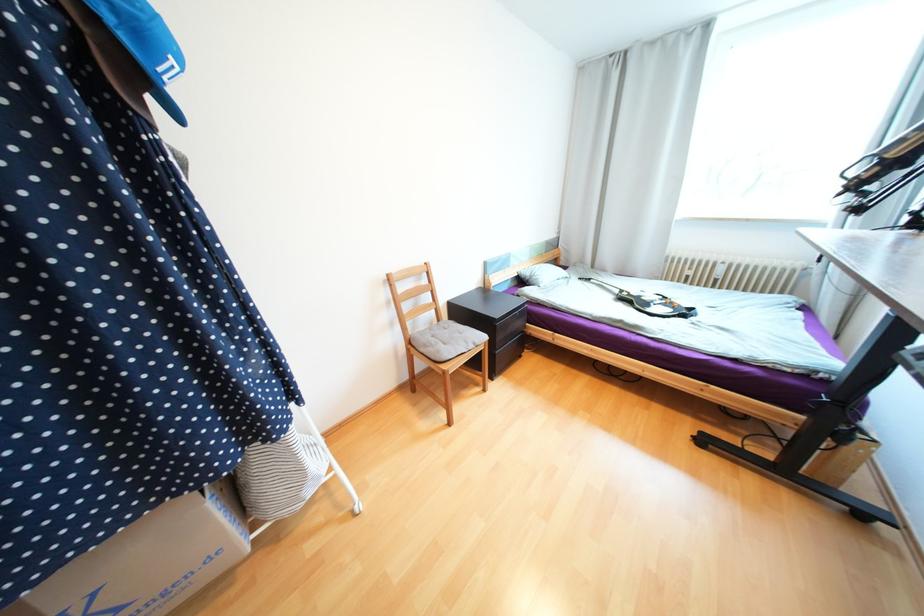
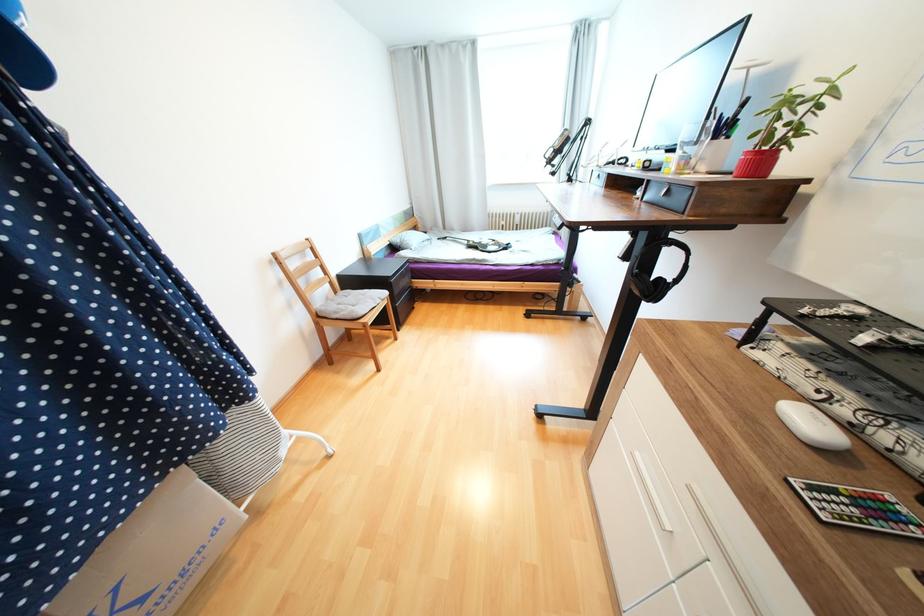
The point at (472, 342) is marked in the first image. Where is the corresponding point in the second image?

(379, 300)